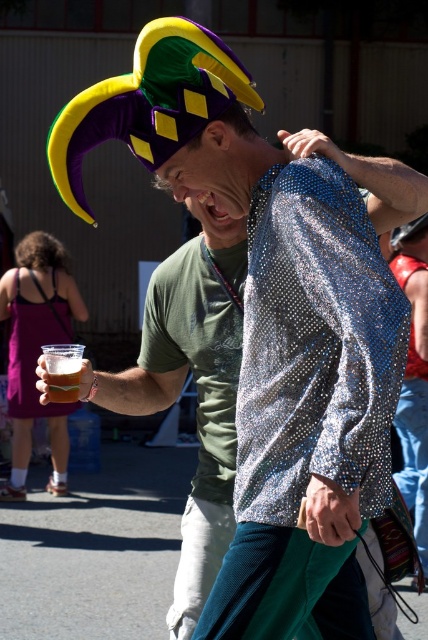
Question: Is brown hair at upper left above shiny metallic hat at upper center?

Choices:
 (A) no
 (B) yes

Answer: (A)

Question: Which object appears closest to the camera in this image?

Choices:
 (A) inflatable jester hat at upper left
 (B) brown hair at upper left
 (C) matte black hat at upper center
 (D) purple satin dress at lower left

Answer: (A)

Question: Which of the following is the farthest from the observer?

Choices:
 (A) inflatable jester hat at upper left
 (B) purple satin dress at lower left
 (C) translucent plastic cup at upper left

Answer: (B)

Question: Which object is farther from the camera taking this photo?

Choices:
 (A) translucent plastic cup at upper left
 (B) brown hair at upper left
 (C) purple satin dress at lower left

Answer: (B)

Question: Can you confirm if inflatable jester hat at upper left is wider than translucent plastic cup at upper left?

Choices:
 (A) no
 (B) yes

Answer: (B)

Question: Does translucent plastic cup at upper left have a greater width compared to matte black hat at upper center?

Choices:
 (A) yes
 (B) no

Answer: (B)